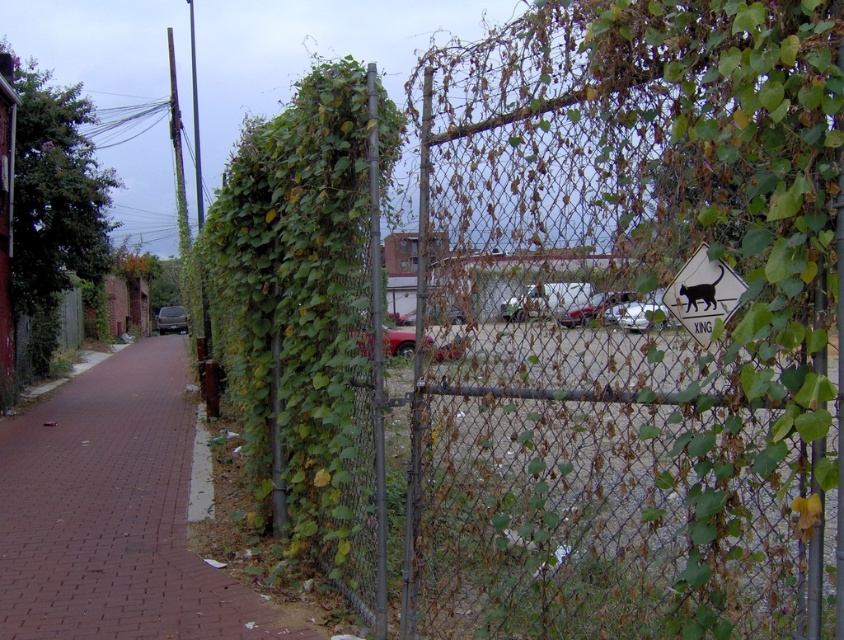
You are a delivery person trying to navigate through the alleyway. You see the white plastic sign at upper right and the metallic silver car at center. Which object is narrower in width?

The white plastic sign at upper right is narrower in width compared to the metallic silver car at center.

You are a delivery person trying to navigate through the alleyway. You see the white plastic sign at upper right and the metallic silver car at center. Which object is positioned higher from the ground?

The white plastic sign at upper right is above metallic silver car at center, so the white plastic sign at upper right is higher from the ground.